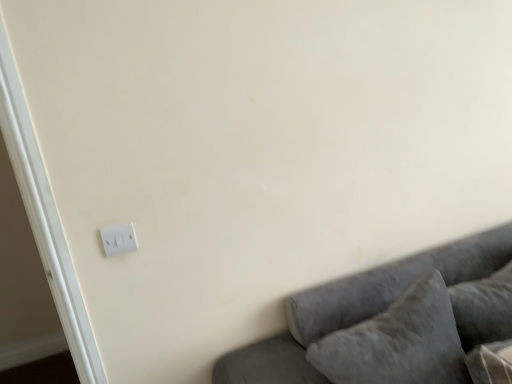
Question: Can you confirm if white plastic light switch at lower left is positioned to the right of velvet gray couch at lower right?

Choices:
 (A) no
 (B) yes

Answer: (A)

Question: Does white plastic light switch at lower left come behind velvet gray couch at lower right?

Choices:
 (A) yes
 (B) no

Answer: (A)

Question: Does white plastic light switch at lower left turn towards velvet gray couch at lower right?

Choices:
 (A) yes
 (B) no

Answer: (B)

Question: Is white plastic light switch at lower left positioned far away from velvet gray couch at lower right?

Choices:
 (A) no
 (B) yes

Answer: (A)

Question: Does white plastic light switch at lower left have a greater height compared to velvet gray couch at lower right?

Choices:
 (A) no
 (B) yes

Answer: (A)

Question: From the image's perspective, is white plastic light switch at lower left on velvet gray couch at lower right?

Choices:
 (A) no
 (B) yes

Answer: (B)

Question: Is velvety gray pillow at lower right, the 1th pillow in the right-to-left sequence, oriented away from velvet gray couch at lower right?

Choices:
 (A) no
 (B) yes

Answer: (B)

Question: Is velvety gray pillow at lower right, positioned as the second pillow in left-to-right order, smaller than velvet gray couch at lower right?

Choices:
 (A) yes
 (B) no

Answer: (A)

Question: From a real-world perspective, does velvety gray pillow at lower right, positioned as the second pillow in left-to-right order, stand above velvet gray couch at lower right?

Choices:
 (A) no
 (B) yes

Answer: (B)

Question: Is velvety gray pillow at lower right, positioned as the second pillow in left-to-right order, wider than velvet gray couch at lower right?

Choices:
 (A) no
 (B) yes

Answer: (A)

Question: Considering the relative sizes of velvety gray pillow at lower right, positioned as the second pillow in left-to-right order, and velvet gray couch at lower right in the image provided, is velvety gray pillow at lower right, positioned as the second pillow in left-to-right order, taller than velvet gray couch at lower right?

Choices:
 (A) no
 (B) yes

Answer: (A)

Question: From the image's perspective, does velvety gray pillow at lower right, positioned as the second pillow in left-to-right order, appear higher than velvet gray couch at lower right?

Choices:
 (A) no
 (B) yes

Answer: (B)

Question: Is velvet gray pillow at lower right, marked as the second pillow in a right-to-left arrangement, thinner than velvet gray couch at lower right?

Choices:
 (A) no
 (B) yes

Answer: (B)